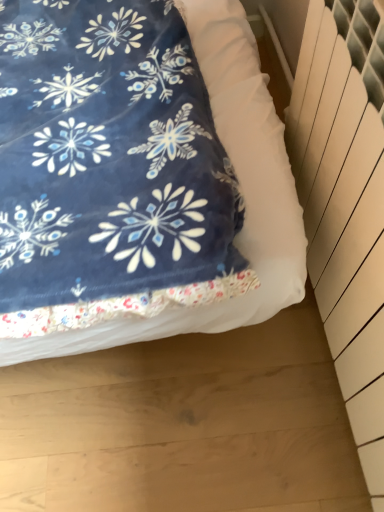
Question: Is velvety blue blanket at upper left at the back of white plastic radiator at right?

Choices:
 (A) yes
 (B) no

Answer: (B)

Question: Is white plastic radiator at right oriented towards velvety blue blanket at upper left?

Choices:
 (A) yes
 (B) no

Answer: (A)

Question: Is white plastic radiator at right positioned far away from velvety blue blanket at upper left?

Choices:
 (A) yes
 (B) no

Answer: (B)

Question: Does white plastic radiator at right appear on the right side of velvety blue blanket at upper left?

Choices:
 (A) yes
 (B) no

Answer: (A)

Question: Are white plastic radiator at right and velvety blue blanket at upper left making contact?

Choices:
 (A) yes
 (B) no

Answer: (B)

Question: Is velvety blue blanket at upper left inside white plastic radiator at right?

Choices:
 (A) yes
 (B) no

Answer: (B)

Question: From the image's perspective, is velvety blue blanket at upper left located beneath white plastic radiator at right?

Choices:
 (A) yes
 (B) no

Answer: (B)

Question: Is velvety blue blanket at upper left in contact with white plastic radiator at right?

Choices:
 (A) no
 (B) yes

Answer: (A)

Question: From the image's perspective, is velvety blue blanket at upper left on white plastic radiator at right?

Choices:
 (A) no
 (B) yes

Answer: (B)

Question: Considering the relative sizes of velvety blue blanket at upper left and white plastic radiator at right in the image provided, is velvety blue blanket at upper left thinner than white plastic radiator at right?

Choices:
 (A) yes
 (B) no

Answer: (B)

Question: Does velvety blue blanket at upper left have a larger size compared to white plastic radiator at right?

Choices:
 (A) no
 (B) yes

Answer: (B)

Question: From a real-world perspective, is velvety blue blanket at upper left on white plastic radiator at right?

Choices:
 (A) no
 (B) yes

Answer: (A)

Question: Visually, is white plastic radiator at right positioned to the left or to the right of velvety blue blanket at upper left?

Choices:
 (A) right
 (B) left

Answer: (A)